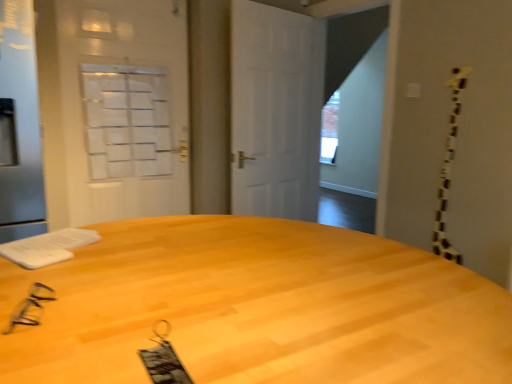
What are the coordinates of `empty space that is ontop of white matte door at center (from a real-world perspective)` in the screenshot? It's located at (271, 8).